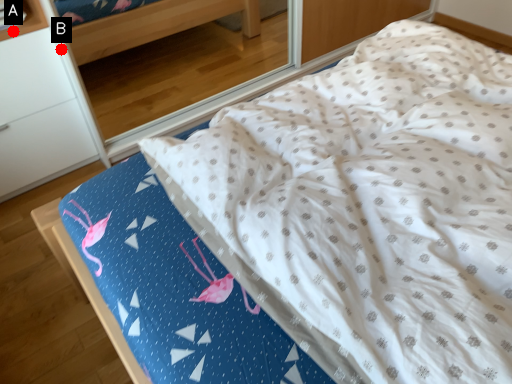
Question: Two points are circled on the image, labeled by A and B beside each circle. Which point is closer to the camera?

Choices:
 (A) A is closer
 (B) B is closer

Answer: (A)